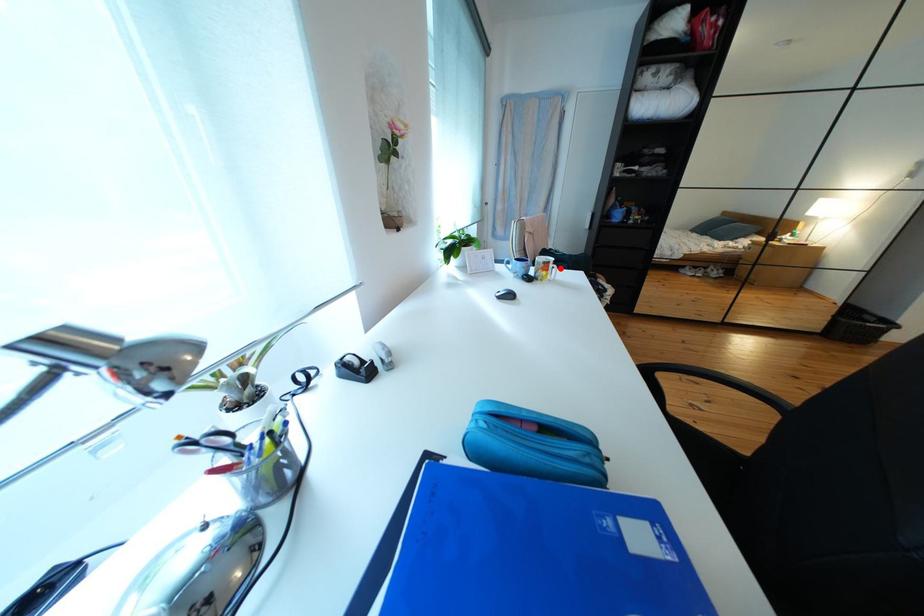
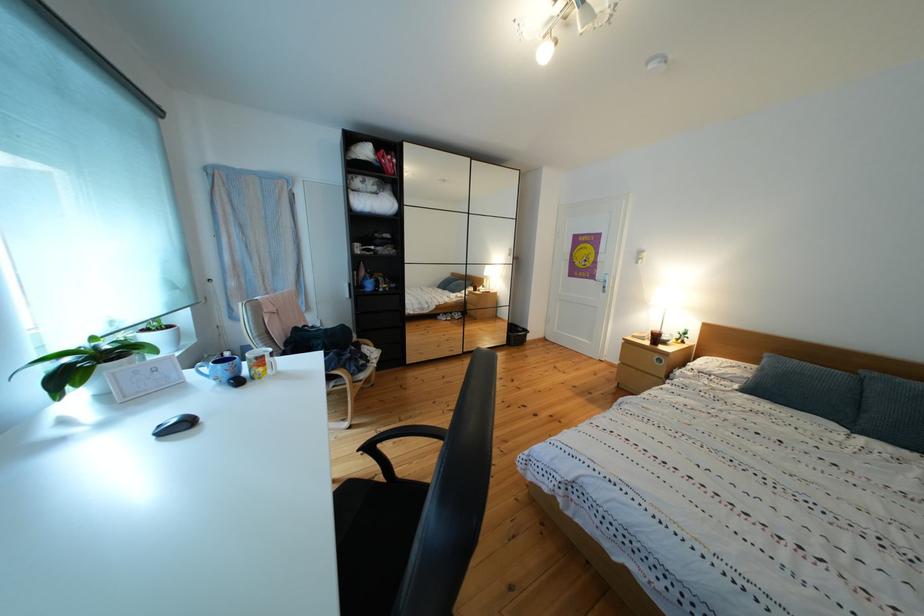
Find the pixel in the second image that matches the highlighted location in the first image.

(274, 362)